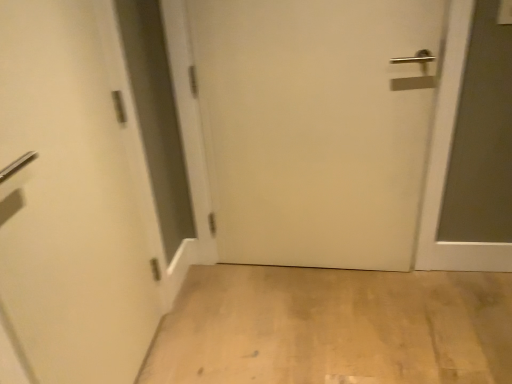
Image resolution: width=512 pixels, height=384 pixels. Find the location of `vacant area to the left of white matte door at center, which appears as the second door when viewed from the left`. vacant area to the left of white matte door at center, which appears as the second door when viewed from the left is located at coordinates (231, 304).